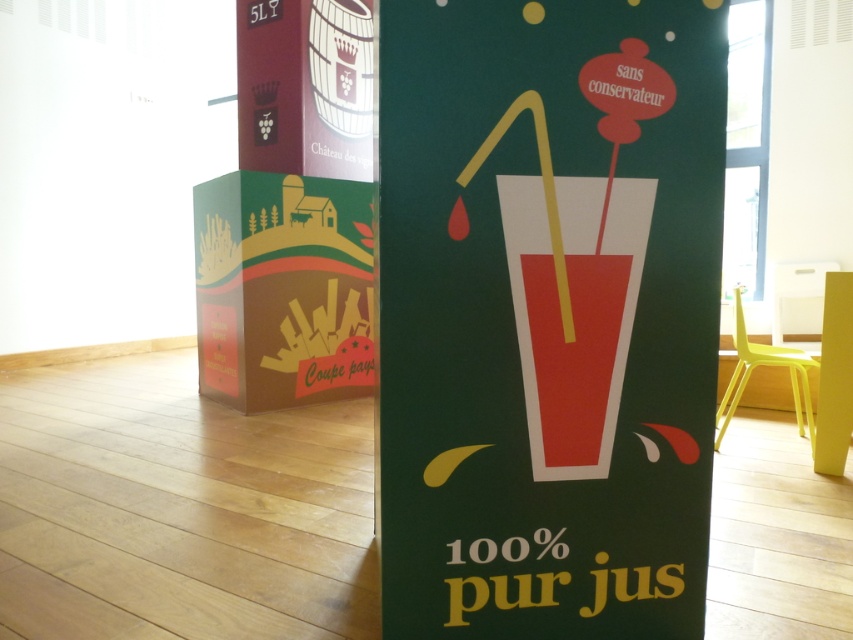
In the scene shown: Which is more to the left, green paperboard sign at center or matte red glass at center?

From the viewer's perspective, green paperboard sign at center appears more on the left side.

This screenshot has width=853, height=640. What do you see at coordinates (547, 314) in the screenshot? I see `green paperboard sign at center` at bounding box center [547, 314].

You are a GUI agent. You are given a task and a screenshot of the screen. Output one action in this format:
    pyautogui.click(x=<x>, y=<y>)
    Task: Click on the green paperboard sign at center
    
    Given the screenshot: What is the action you would take?
    pyautogui.click(x=547, y=314)